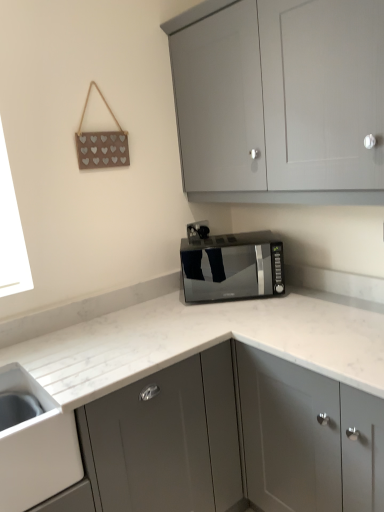
Question: Looking at the image, does matte gray cabinet at upper center, which ranks as the first cabinetry in top-to-bottom order, seem bigger or smaller compared to black plastic electric outlet at center?

Choices:
 (A) big
 (B) small

Answer: (A)

Question: In the image, is matte gray cabinet at upper center, the second cabinetry when ordered from bottom to top, positioned in front of or behind black plastic electric outlet at center?

Choices:
 (A) front
 (B) behind

Answer: (A)

Question: Considering the real-world distances, which object is farthest from the matte gray cabinet at upper center, the second cabinetry when ordered from bottom to top?

Choices:
 (A) satin grey cabinet at center, which ranks as the second cabinetry in top-to-bottom order
 (B) satin black microwave at center
 (C) white glossy sink at lower left
 (D) black plastic electric outlet at center

Answer: (C)

Question: Which of these objects is positioned closest to the white glossy sink at lower left?

Choices:
 (A) black plastic electric outlet at center
 (B) matte gray cabinet at upper center, the second cabinetry when ordered from bottom to top
 (C) satin black microwave at center
 (D) satin grey cabinet at center, which ranks as the second cabinetry in top-to-bottom order

Answer: (D)